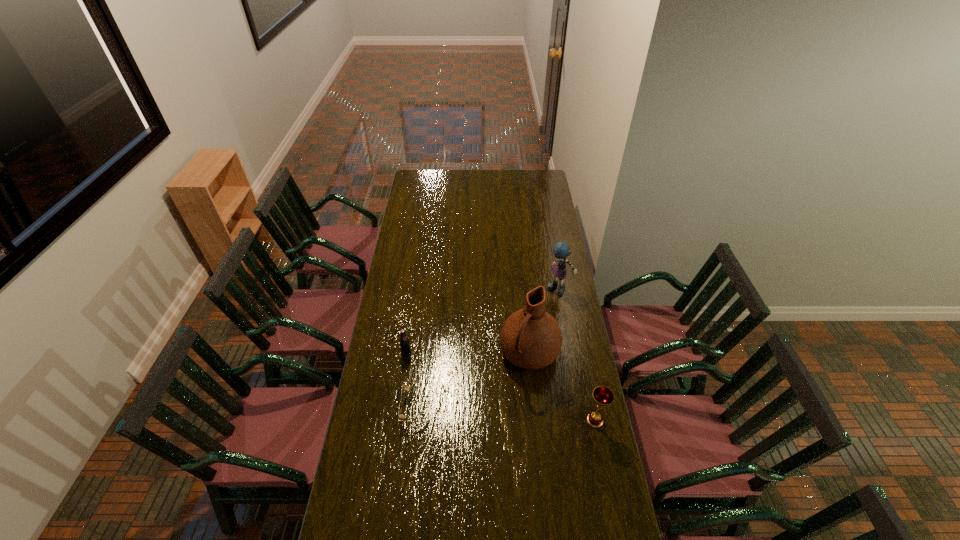
Identify the location of vacant area that lies between the pop and the sunglasses. (414, 381).

This screenshot has height=540, width=960. Identify the location of free space between the sunglasses and the chalice. (508, 414).

I want to click on free point between the chalice and the sunglasses, so click(508, 414).

The height and width of the screenshot is (540, 960). I want to click on empty space that is in between the sunglasses and the fourth tallest object, so click(414, 381).

The width and height of the screenshot is (960, 540). I want to click on unoccupied position between the second shortest object and the sunglasses, so click(x=414, y=381).

Select which object is the third closest to the rag doll. Please provide its 2D coordinates. Your answer should be formatted as a tuple, i.e. [(x, y)], where the tuple contains the x and y coordinates of a point satisfying the conditions above.

[(404, 342)]

Choose which object is the third nearest neighbor to the sunglasses. Please provide its 2D coordinates. Your answer should be formatted as a tuple, i.e. [(x, y)], where the tuple contains the x and y coordinates of a point satisfying the conditions above.

[(603, 396)]

Image resolution: width=960 pixels, height=540 pixels. I want to click on free space that satisfies the following two spatial constraints: 1. on the front side of the fourth tallest object; 2. on the front lenses of the shortest object, so click(398, 408).

Where is `vacant region that satisfies the following two spatial constraints: 1. on the back side of the tallest object; 2. on the left side of the second shortest object`? vacant region that satisfies the following two spatial constraints: 1. on the back side of the tallest object; 2. on the left side of the second shortest object is located at coordinates (407, 352).

This screenshot has height=540, width=960. What are the coordinates of `free space that satisfies the following two spatial constraints: 1. on the front side of the pitcher; 2. on the right side of the chalice` in the screenshot? It's located at pyautogui.click(x=536, y=420).